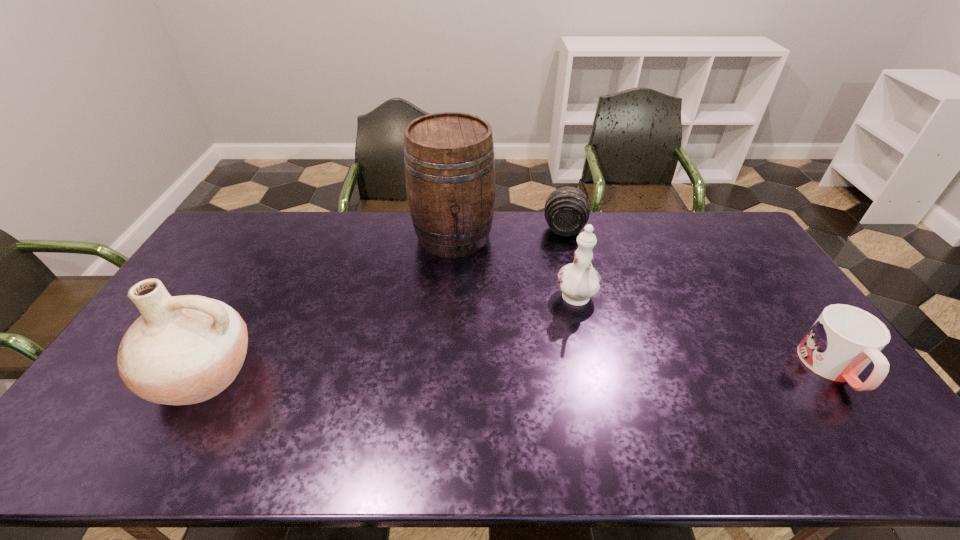
Locate an element on the screen. This screenshot has height=540, width=960. free location located at the front element of the telephoto lens is located at coordinates (558, 303).

This screenshot has height=540, width=960. I want to click on vacant space located at the front element of the telephoto lens, so click(560, 288).

Identify the location of vacant space located 0.340m at the front element of the telephoto lens. The width and height of the screenshot is (960, 540). (558, 307).

Image resolution: width=960 pixels, height=540 pixels. In order to click on vacant space situated on the side of the cider near the bung hole in this screenshot , I will do `click(463, 299)`.

Identify the location of vacant area located on the side of the cider near the bung hole. The image size is (960, 540). (466, 318).

Identify the location of vacant space situated 0.140m on the side of the cider near the bung hole. The height and width of the screenshot is (540, 960). (461, 290).

Locate an element on the screen. The height and width of the screenshot is (540, 960). telephoto lens that is at the far edge is located at coordinates (567, 209).

Identify the location of cider positioned at the far edge. (449, 162).

Locate an element on the screen. The height and width of the screenshot is (540, 960). pottery that is at the near edge is located at coordinates (182, 350).

Locate an element on the screen. mug at the near edge is located at coordinates (844, 339).